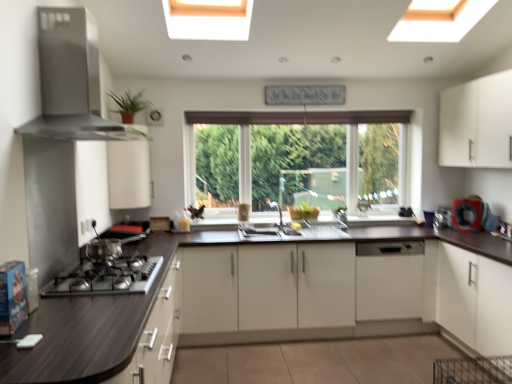
Question: Does dark wood countertop at lower left have a larger size compared to stainless steel range hood at upper left?

Choices:
 (A) yes
 (B) no

Answer: (A)

Question: Does dark wood countertop at lower left have a lesser width compared to stainless steel range hood at upper left?

Choices:
 (A) yes
 (B) no

Answer: (B)

Question: Is stainless steel range hood at upper left at the back of dark wood countertop at lower left?

Choices:
 (A) no
 (B) yes

Answer: (A)

Question: Considering the relative sizes of dark wood countertop at lower left and stainless steel range hood at upper left in the image provided, is dark wood countertop at lower left smaller than stainless steel range hood at upper left?

Choices:
 (A) yes
 (B) no

Answer: (B)

Question: Is dark wood countertop at lower left not close to stainless steel range hood at upper left?

Choices:
 (A) no
 (B) yes

Answer: (B)

Question: Choose the correct answer: Is white matte cabinet at upper right, arranged as the first cabinetry when viewed from the right, inside white matte dishwasher at lower center, which is the 2th cabinetry in right-to-left order, or outside it?

Choices:
 (A) outside
 (B) inside

Answer: (A)

Question: Is white matte cabinet at upper right, acting as the fourth cabinetry starting from the left, wider or thinner than white matte dishwasher at lower center, the third cabinetry from the left?

Choices:
 (A) thin
 (B) wide

Answer: (B)

Question: From their relative heights in the image, would you say white matte cabinet at upper right, acting as the fourth cabinetry starting from the left, is taller or shorter than white matte dishwasher at lower center, which is the 2th cabinetry in right-to-left order?

Choices:
 (A) short
 (B) tall

Answer: (B)

Question: From a real-world perspective, is white matte cabinet at upper right, acting as the fourth cabinetry starting from the left, above or below white matte dishwasher at lower center, which is the 2th cabinetry in right-to-left order?

Choices:
 (A) below
 (B) above

Answer: (B)

Question: Considering their positions, is stainless steel range hood at upper left located in front of or behind white matte cabinet at upper right, arranged as the first cabinetry when viewed from the right?

Choices:
 (A) behind
 (B) front

Answer: (B)

Question: Visually, is stainless steel range hood at upper left positioned to the left or to the right of white matte cabinet at upper right, arranged as the first cabinetry when viewed from the right?

Choices:
 (A) left
 (B) right

Answer: (A)

Question: Considering the positions of point (74, 34) and point (480, 160), is point (74, 34) closer or farther from the camera than point (480, 160)?

Choices:
 (A) closer
 (B) farther

Answer: (A)

Question: From the image's perspective, is stainless steel range hood at upper left positioned above or below white matte cabinet at upper right, arranged as the first cabinetry when viewed from the right?

Choices:
 (A) below
 (B) above

Answer: (B)

Question: In terms of size, does black rubber ring at right appear bigger or smaller than green matte plant at upper left?

Choices:
 (A) big
 (B) small

Answer: (B)

Question: Is point (456, 218) closer or farther from the camera than point (117, 112)?

Choices:
 (A) farther
 (B) closer

Answer: (A)